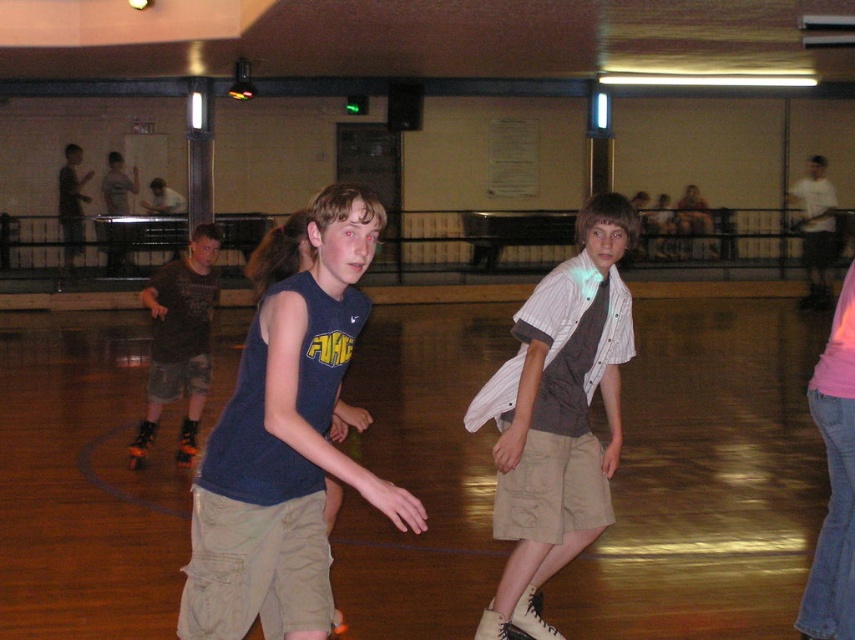
Question: Which object is positioned closest to the black matte roller skate at center?

Choices:
 (A) camouflage shorts at left
 (B) striped cotton shirt at center

Answer: (A)

Question: From the image, what is the correct spatial relationship of matte blue tank top at center in relation to orange roller skate at lower left?

Choices:
 (A) above
 (B) below

Answer: (A)

Question: Is matte blue tank top at center wider than striped cotton shirt at center?

Choices:
 (A) yes
 (B) no

Answer: (A)

Question: Based on their relative distances, which object is nearer to the camouflage shorts at left?

Choices:
 (A) white matte roller skate at lower center
 (B) striped cotton shirt at center
 (C) matte blue tank top at center

Answer: (B)

Question: Among these objects, which one is farthest from the camera?

Choices:
 (A) matte blue tank top at center
 (B) camouflage shorts at left
 (C) white matte roller skate at lower center

Answer: (B)

Question: Does striped cotton shirt at center have a larger size compared to white matte roller skate at lower center?

Choices:
 (A) yes
 (B) no

Answer: (A)